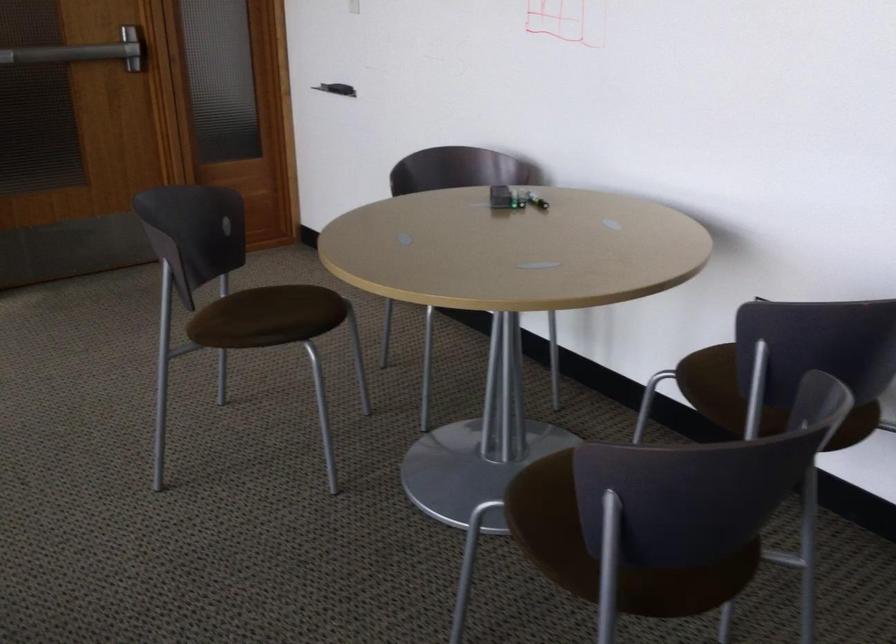
This screenshot has height=644, width=896. What do you see at coordinates (74, 55) in the screenshot? I see `the silver door handle` at bounding box center [74, 55].